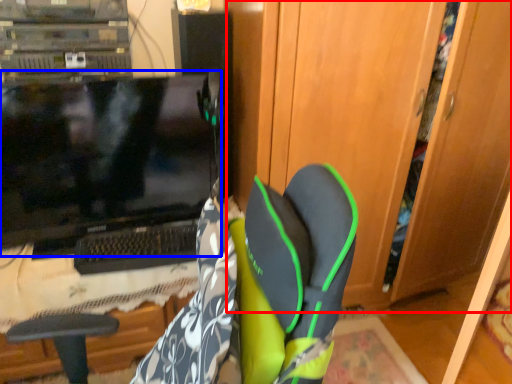
Question: Which of the following is the farthest to the observer, dresser (highlighted by a red box) or computer monitor (highlighted by a blue box)?

Choices:
 (A) dresser
 (B) computer monitor

Answer: (B)